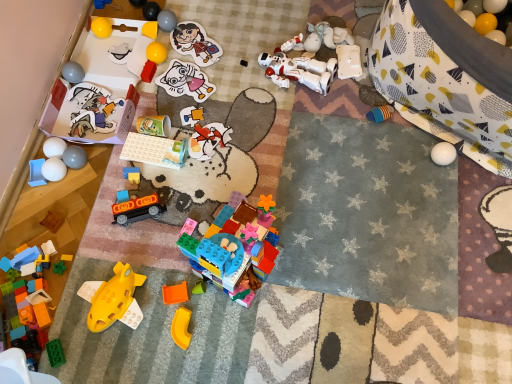
The height and width of the screenshot is (384, 512). Identify the location of free point behind matte gray ball at upper center, arranged as the eighth toy when viewed from the right. (177, 10).